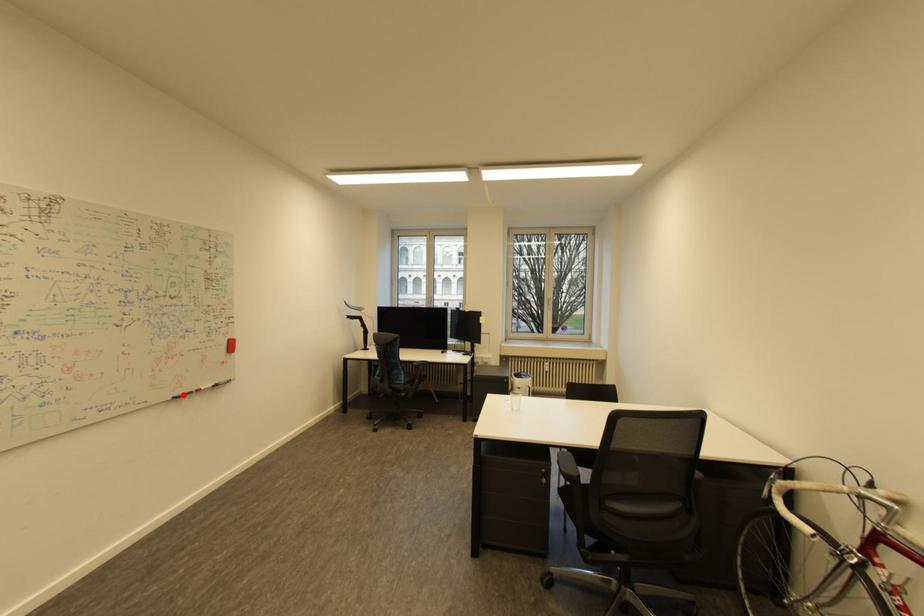
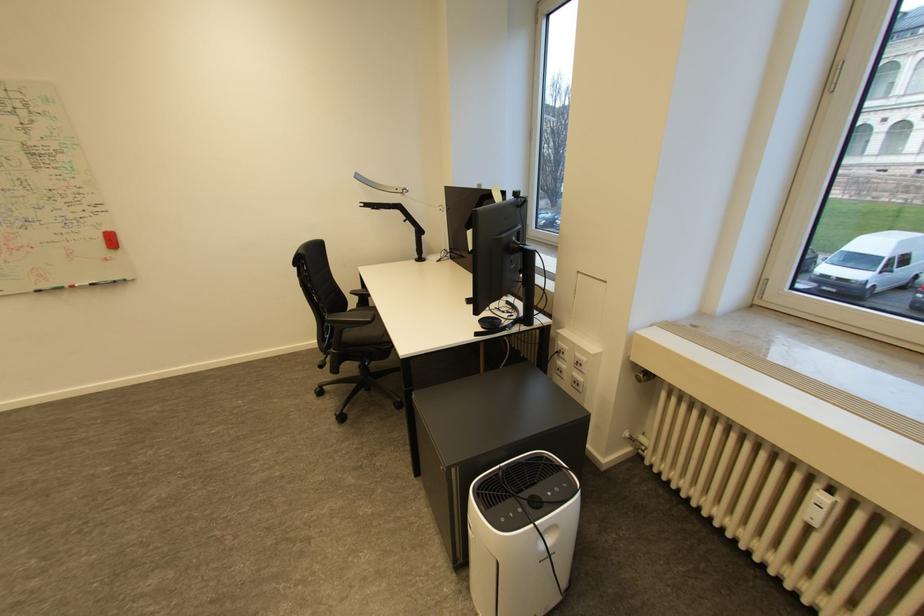
Where in the second image is the point corresponding to the highlighted location from the first image?

(47, 288)